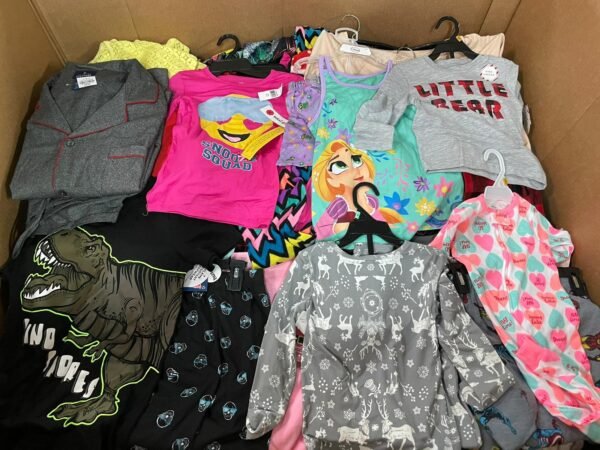
Where is `hanger`? hanger is located at coordinates (374, 228), (454, 42), (356, 18), (351, 28), (237, 41), (495, 187).